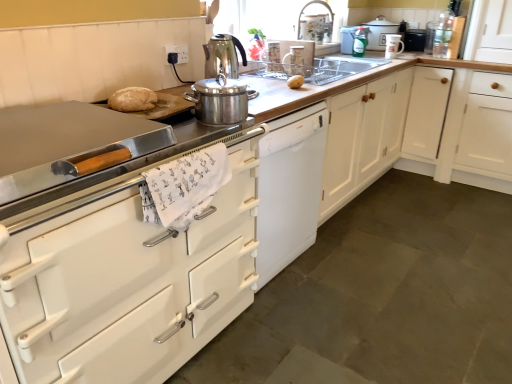
Locate an element on the screen. free space in front of yellow matte potato at center is located at coordinates (295, 85).